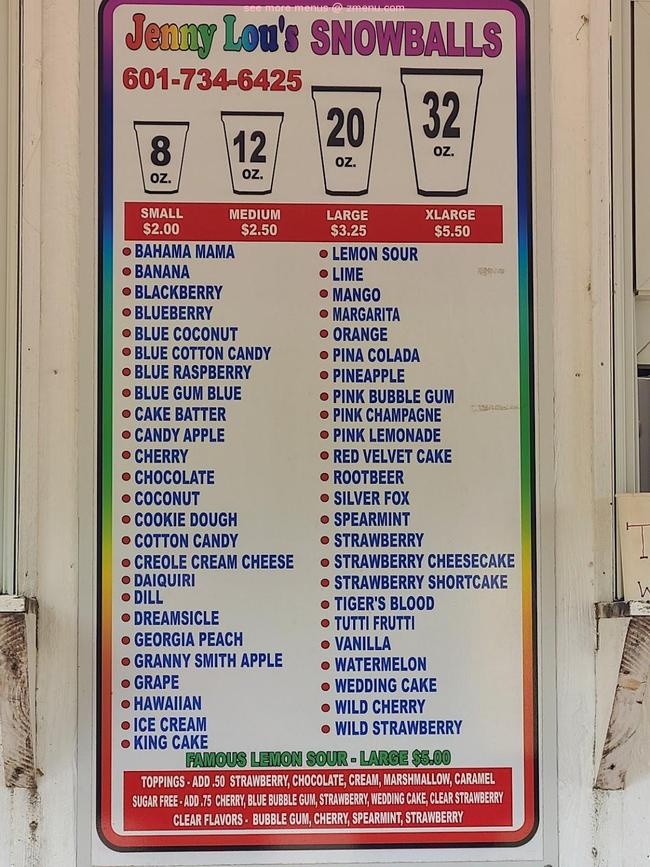
What are the coordinates of `cup rim` in the screenshot? It's located at (445, 68), (344, 90), (255, 111), (160, 124).